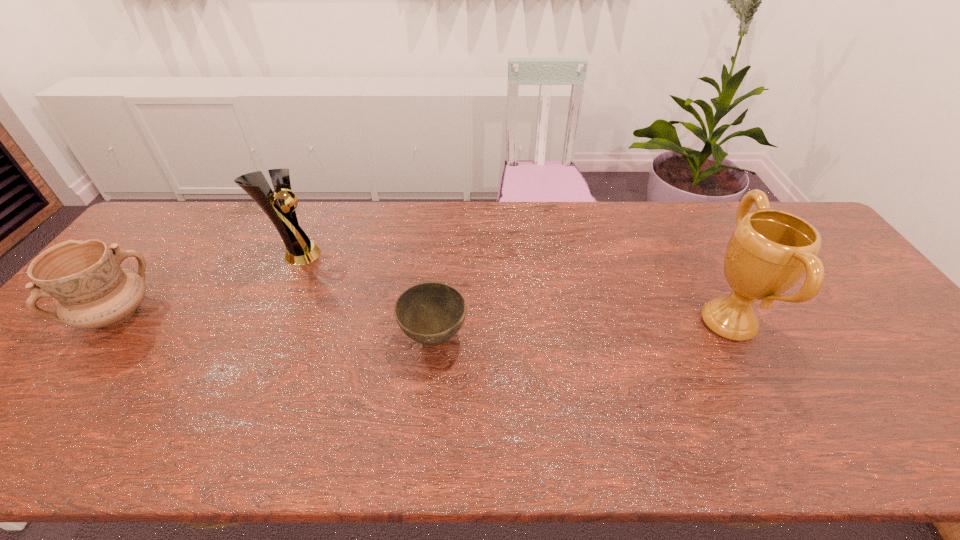
At what (x,y) coordinates should I click in order to perform the action: click on the rightmost object. Please return your answer as a coordinate pair (x, y). Image resolution: width=960 pixels, height=540 pixels. Looking at the image, I should click on (x=769, y=251).

Image resolution: width=960 pixels, height=540 pixels. Find the location of `the right award`. the right award is located at coordinates (769, 251).

The width and height of the screenshot is (960, 540). Find the location of `the third object from right to left`. the third object from right to left is located at coordinates (300, 250).

The image size is (960, 540). Find the location of `the farthest object`. the farthest object is located at coordinates tap(300, 250).

I want to click on the leftmost object, so pos(92,290).

The image size is (960, 540). I want to click on pottery, so click(92, 290).

Locate an element on the screen. This screenshot has height=540, width=960. bowl is located at coordinates (431, 313).

Image resolution: width=960 pixels, height=540 pixels. I want to click on the third object from left to right, so click(x=431, y=313).

The width and height of the screenshot is (960, 540). In order to click on vacant space situated on the front of the nearer award with the decoration in this screenshot , I will do `click(624, 322)`.

The image size is (960, 540). In order to click on vacant area situated on the front of the nearer award with the decoration in this screenshot , I will do `click(593, 322)`.